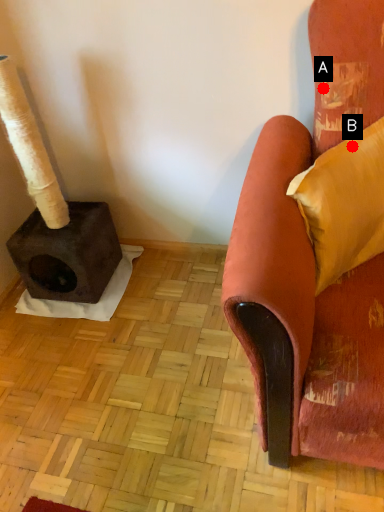
Question: Two points are circled on the image, labeled by A and B beside each circle. Among these points, which one is farthest from the camera?

Choices:
 (A) A is further
 (B) B is further

Answer: (A)